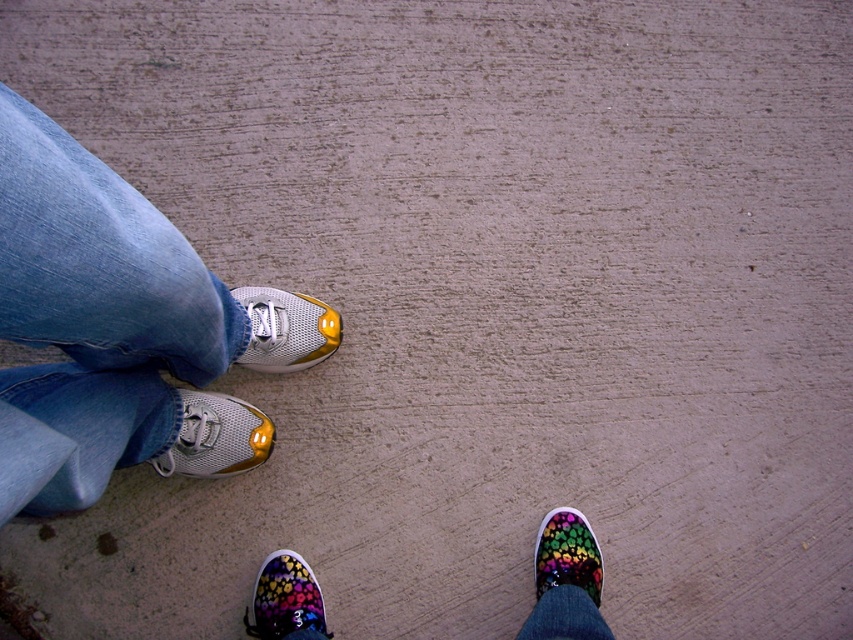
Question: Which of the following is the farthest from the observer?

Choices:
 (A) click(572, 628)
 (B) click(287, 604)

Answer: (B)

Question: Does floral canvas sneaker at lower right lie behind jeans at lower right?

Choices:
 (A) yes
 (B) no

Answer: (A)

Question: Which point is closer to the camera?

Choices:
 (A) (62, 284)
 (B) (242, 410)

Answer: (A)

Question: Which point is closer to the camera taking this photo?

Choices:
 (A) (234, 292)
 (B) (310, 604)
 (C) (595, 604)
 (D) (590, 529)

Answer: (C)

Question: Considering the relative positions of blue denim jeans at left and multicolored canvas sneakers at lower right in the image provided, where is blue denim jeans at left located with respect to multicolored canvas sneakers at lower right?

Choices:
 (A) right
 (B) left

Answer: (B)

Question: Can you confirm if multicolored canvas sneakers at lower right is thinner than shiny metallic sneaker at left?

Choices:
 (A) no
 (B) yes

Answer: (B)